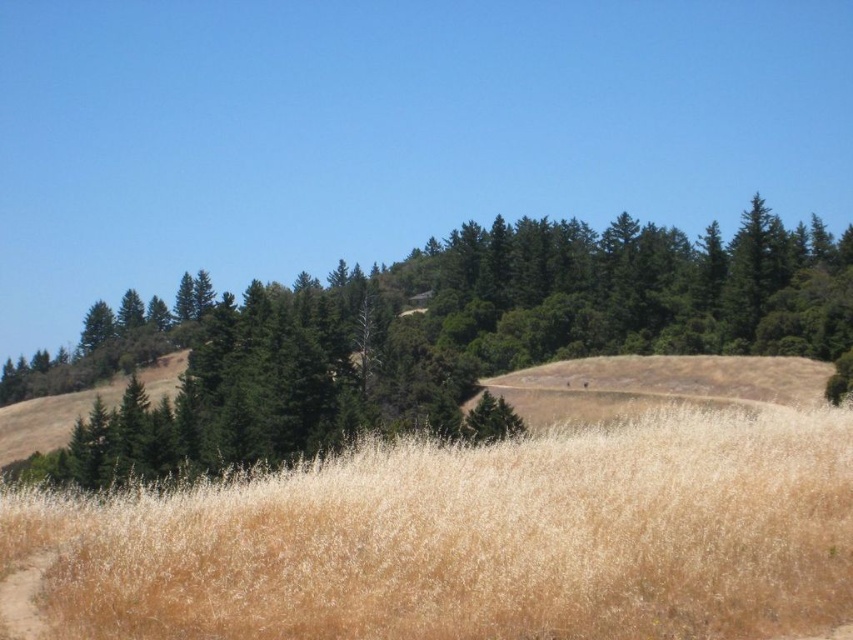
What do you see at coordinates (474, 540) in the screenshot? I see `dry grass at center` at bounding box center [474, 540].

Does point (691, 625) come behind point (405, 362)?

No, it is not.

Find the location of a particular element. This screenshot has height=640, width=853. dry grass at center is located at coordinates (474, 540).